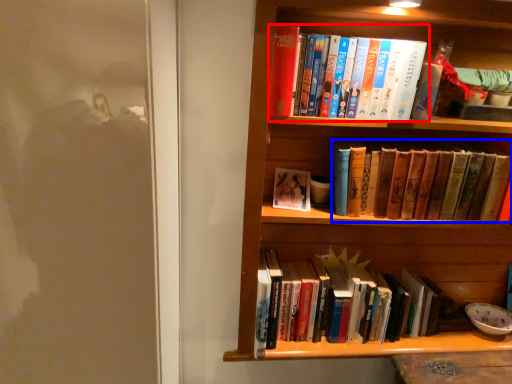
Question: Which object is further to the camera taking this photo, book (highlighted by a red box) or book (highlighted by a blue box)?

Choices:
 (A) book
 (B) book

Answer: (B)